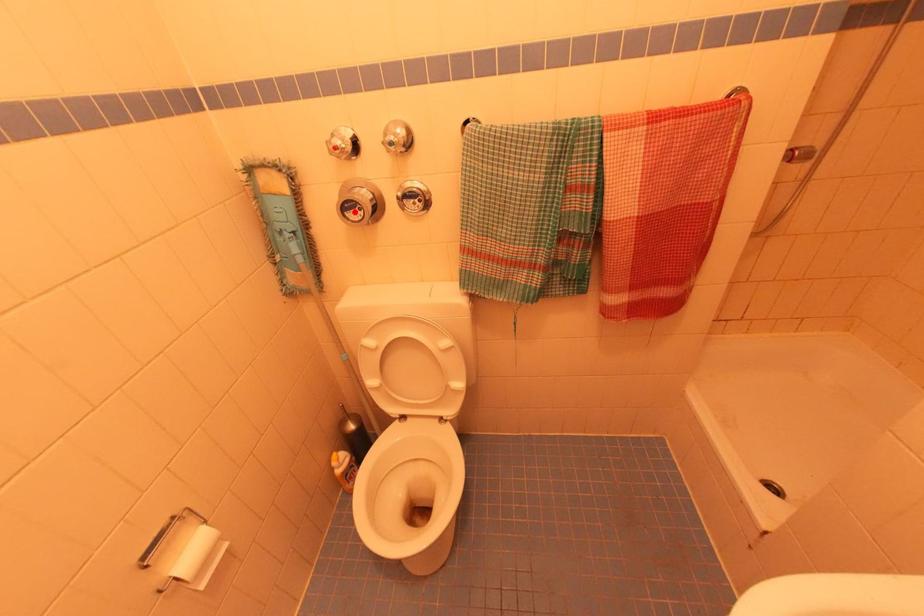
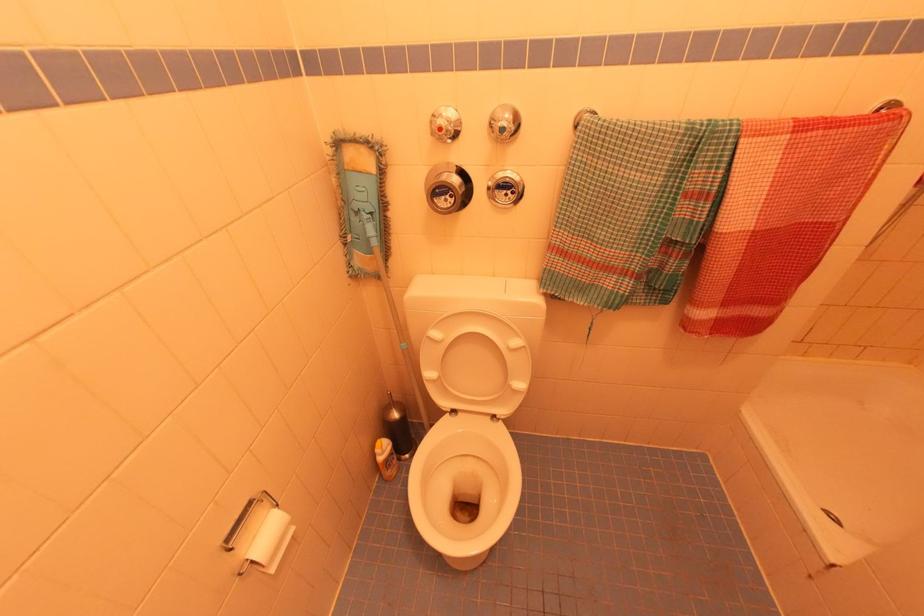
Find the pixel in the second image that matches the highlighted location in the first image.

(444, 198)